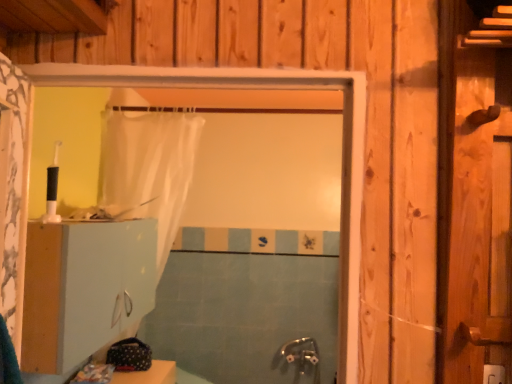
You are a GUI agent. You are given a task and a screenshot of the screen. Output one action in this format:
    pyautogui.click(x=<x>, y=<y>)
    Task: Click on the blank space situated above blue tile bath at center (from a real-world perspective)
    This screenshot has height=384, width=512.
    Given the screenshot: What is the action you would take?
    pyautogui.click(x=236, y=221)